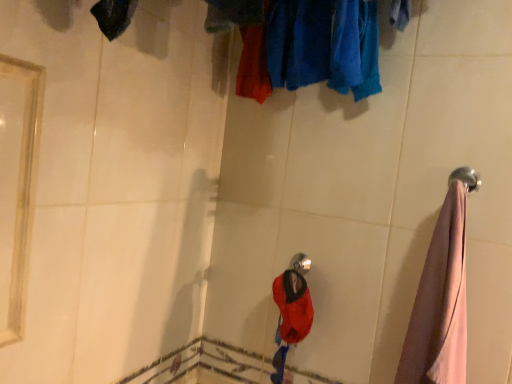
Question: In terms of height, does shiny metallic shower head at center look taller or shorter compared to pink fabric towel at right?

Choices:
 (A) short
 (B) tall

Answer: (A)

Question: From a real-world perspective, is shiny metallic shower head at center positioned above or below pink fabric towel at right?

Choices:
 (A) below
 (B) above

Answer: (A)

Question: Based on their relative distances, which object is farther from the shiny metallic shower head at center?

Choices:
 (A) pink fabric towel at right
 (B) polished silver towel rack at right
 (C) velvet-like red hat at center

Answer: (B)

Question: Based on their relative distances, which object is farther from the pink fabric towel at right?

Choices:
 (A) polished silver towel rack at right
 (B) velvet-like red hat at center
 (C) shiny metallic shower head at center

Answer: (C)